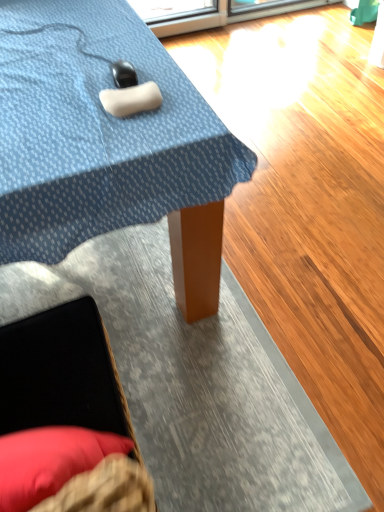
Where is `matte blue table at upper left`? matte blue table at upper left is located at coordinates [x=107, y=144].

This screenshot has height=512, width=384. Describe the element at coordinates (107, 144) in the screenshot. I see `matte blue table at upper left` at that location.

Identify the location of matte blue table at upper left. (107, 144).